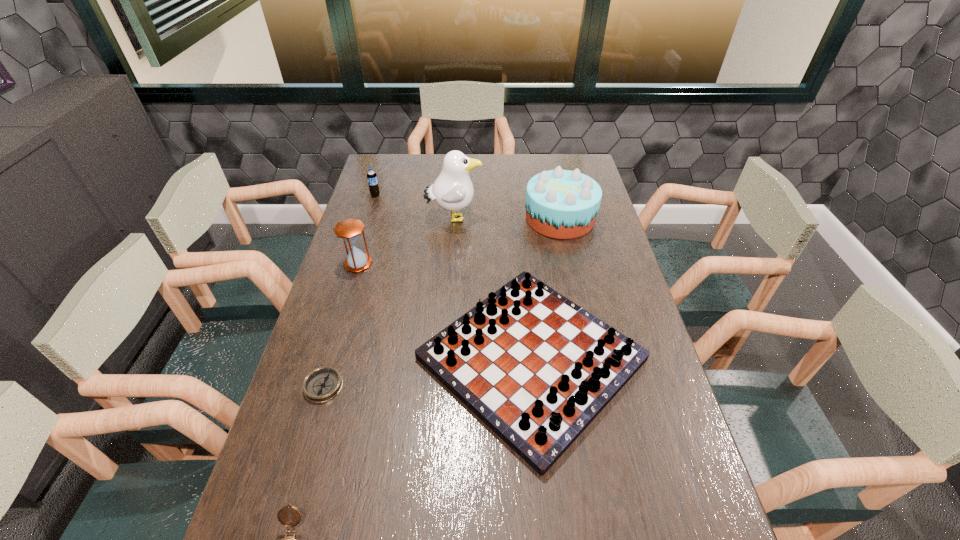
I want to click on free space at the left edge of the desktop, so click(385, 222).

The height and width of the screenshot is (540, 960). In the image, there is a desktop. Identify the location of blank space at the right edge. (663, 415).

The image size is (960, 540). In order to click on free space at the far right corner of the desktop in this screenshot , I will do 575,163.

Locate an element on the screen. empty space between the chessboard and the tallest object is located at coordinates (492, 288).

What are the coordinates of `free space between the chessboard and the soda bottle` in the screenshot? It's located at (453, 277).

Locate an element on the screen. This screenshot has height=540, width=960. free spot between the soda bottle and the tallest object is located at coordinates (415, 206).

The image size is (960, 540). What are the coordinates of `free space between the fourth nearest object and the shortest object` in the screenshot? It's located at (341, 325).

Where is `empty space that is in between the gull and the chessboard`? The width and height of the screenshot is (960, 540). empty space that is in between the gull and the chessboard is located at coordinates (492, 288).

I want to click on vacant area that lies between the soda bottle and the fourth farthest object, so click(367, 229).

Identify which object is located as the sixth nearest to the fifth shortest object. Please provide its 2D coordinates. Your answer should be formatted as a tuple, i.e. [(x, y)], where the tuple contains the x and y coordinates of a point satisfying the conditions above.

[(283, 515)]